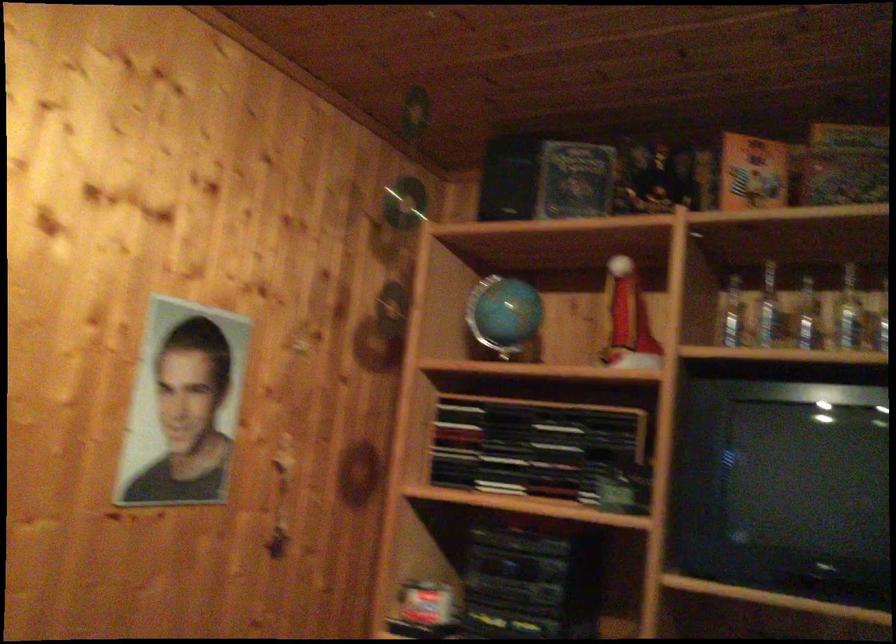
Which object does [626,319] point to?

This point indicates the red Santa hat.